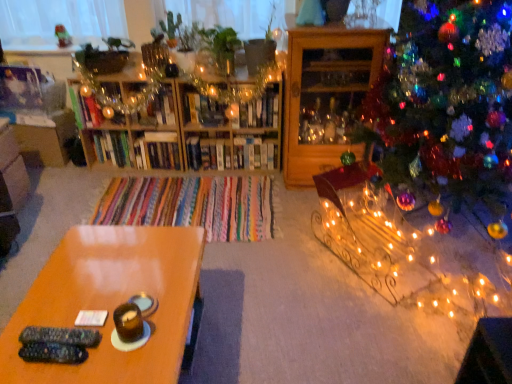
You are a GUI agent. You are given a task and a screenshot of the screen. Output one action in this format:
    pyautogui.click(x=<x>, y=<y>)
    Task: Click on the vacant area on top of glossy wood table at lower left (from a real-world perspective)
    Image resolution: width=512 pixels, height=384 pixels.
    Given the screenshot: What is the action you would take?
    pyautogui.click(x=108, y=284)